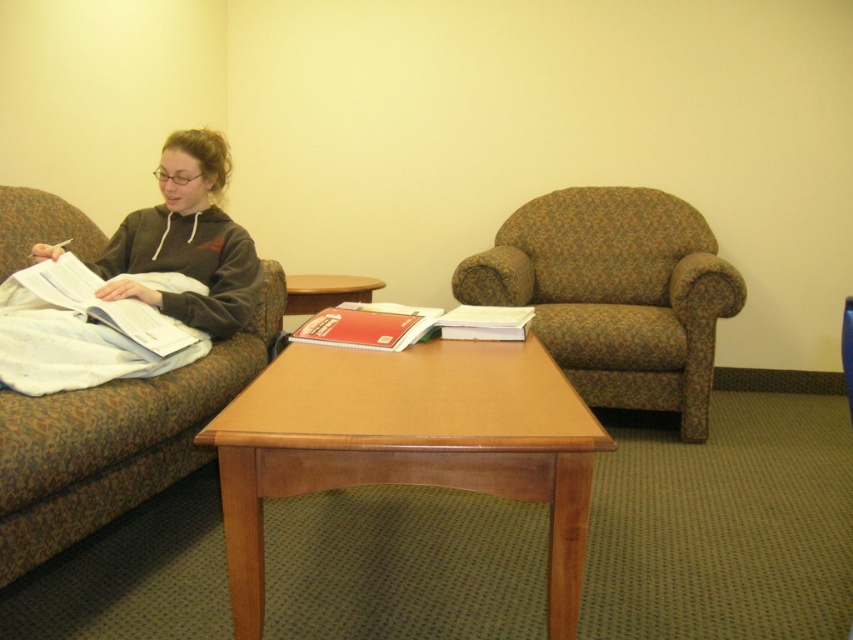
You are standing in the room and want to pick up the dark gray hoodie at upper left. Based on its position, where should you look to find it?

The dark gray hoodie at upper left is located at the 2D coordinates point (187, 241), so you should look towards the upper left area of the image to find it.